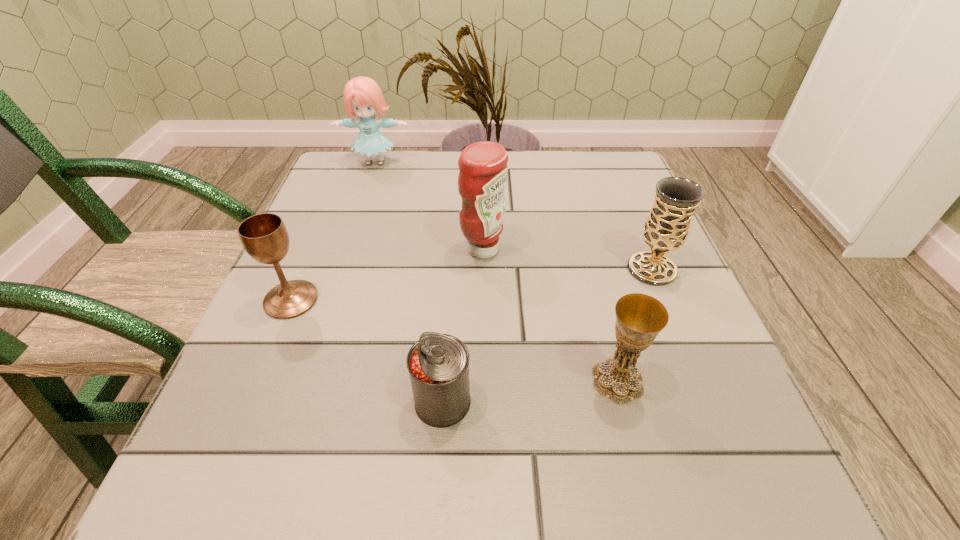
Image resolution: width=960 pixels, height=540 pixels. I want to click on object that is the fourth closest to the doll, so click(x=438, y=364).

Where is `chalice that can be found as the closest to the doll`? This screenshot has height=540, width=960. chalice that can be found as the closest to the doll is located at coordinates (264, 236).

Point out which chalice is positioned as the nearest to the condiment. Please provide its 2D coordinates. Your answer should be formatted as a tuple, i.e. [(x, y)], where the tuple contains the x and y coordinates of a point satisfying the conditions above.

[(676, 199)]

At what (x,y) coordinates should I click in order to perform the action: click on blank space that satisfies the following two spatial constraints: 1. on the front-facing side of the doll; 2. on the right side of the second chalice from left to right. Please return your answer as a coordinate pair (x, y). This screenshot has height=540, width=960. Looking at the image, I should click on pyautogui.click(x=302, y=381).

This screenshot has height=540, width=960. In order to click on free space that satisfies the following two spatial constraints: 1. on the back side of the rightmost object; 2. on the left side of the leftmost chalice in this screenshot , I will do `click(304, 269)`.

I want to click on free spot that satisfies the following two spatial constraints: 1. on the front-facing side of the condiment; 2. on the right side of the farthest object, so click(x=347, y=249).

Image resolution: width=960 pixels, height=540 pixels. I want to click on vacant space that satisfies the following two spatial constraints: 1. on the front side of the leftmost chalice; 2. on the left side of the shortest object, so click(x=249, y=402).

Find the location of a particular element. This screenshot has width=960, height=540. free space that satisfies the following two spatial constraints: 1. on the front-facing side of the farthest object; 2. on the left side of the rightmost chalice is located at coordinates (340, 269).

The height and width of the screenshot is (540, 960). I want to click on free space that satisfies the following two spatial constraints: 1. on the front side of the leftmost chalice; 2. on the left side of the can, so click(x=249, y=402).

The width and height of the screenshot is (960, 540). What are the coordinates of `vacant region that satisfies the following two spatial constraints: 1. on the front side of the rightmost chalice; 2. on the left side of the condiment` in the screenshot? It's located at point(483,269).